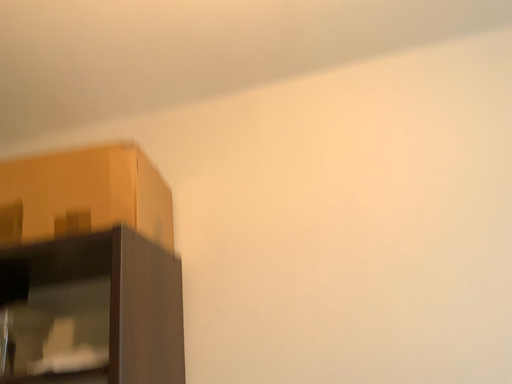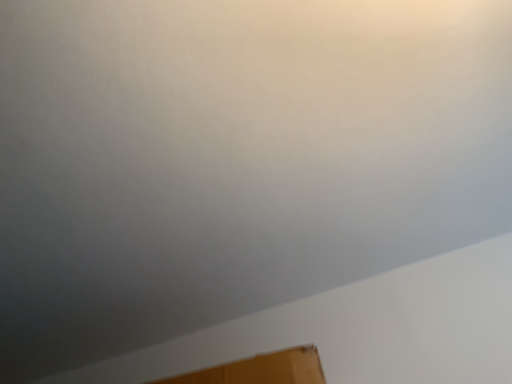
Question: Which way did the camera rotate in the video?

Choices:
 (A) rotated downward
 (B) rotated upward

Answer: (B)